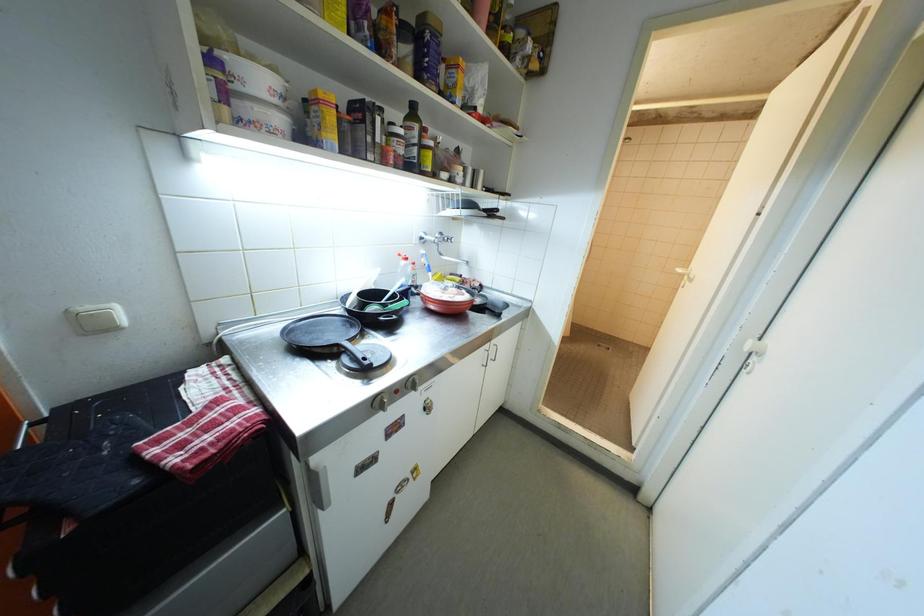
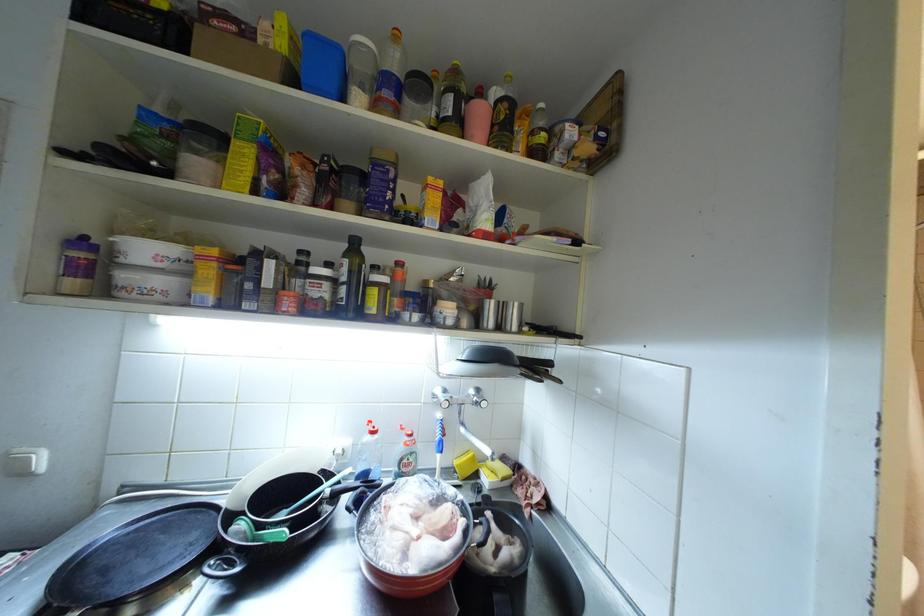
The images are taken continuously from a first-person perspective. In which direction is your viewpoint rotating?

The rotation direction of the camera is left-up.